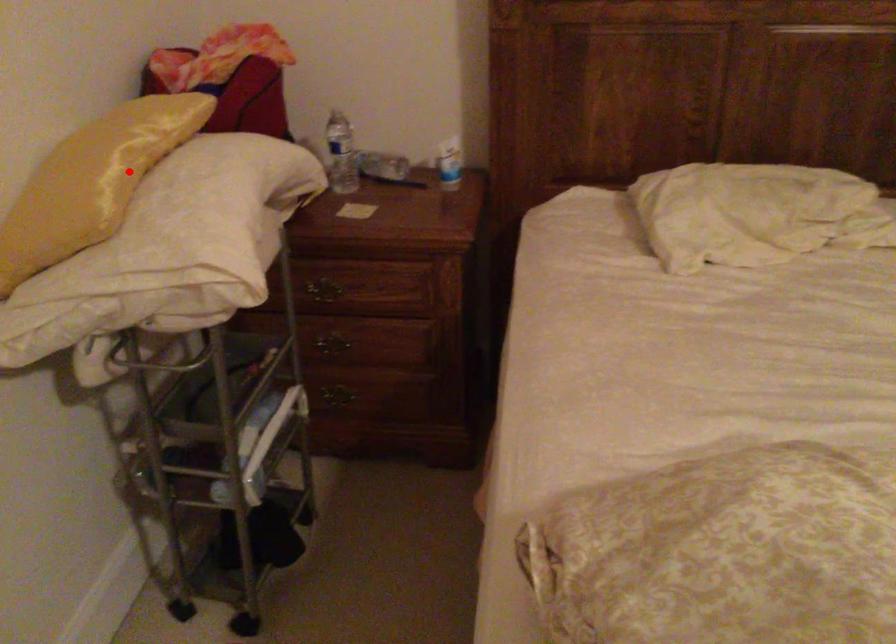
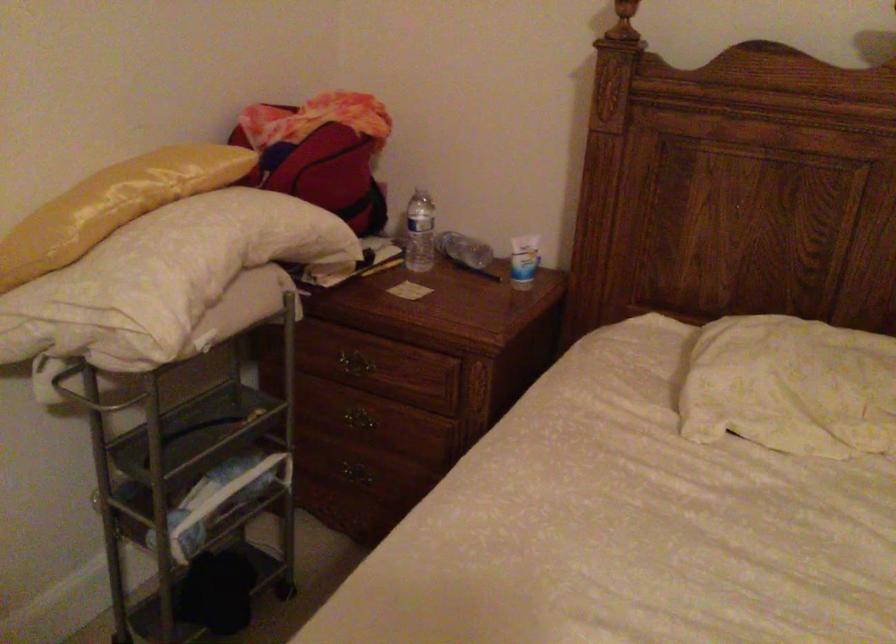
Where in the second image is the point corresponding to the highlighted location from the first image?

(113, 205)